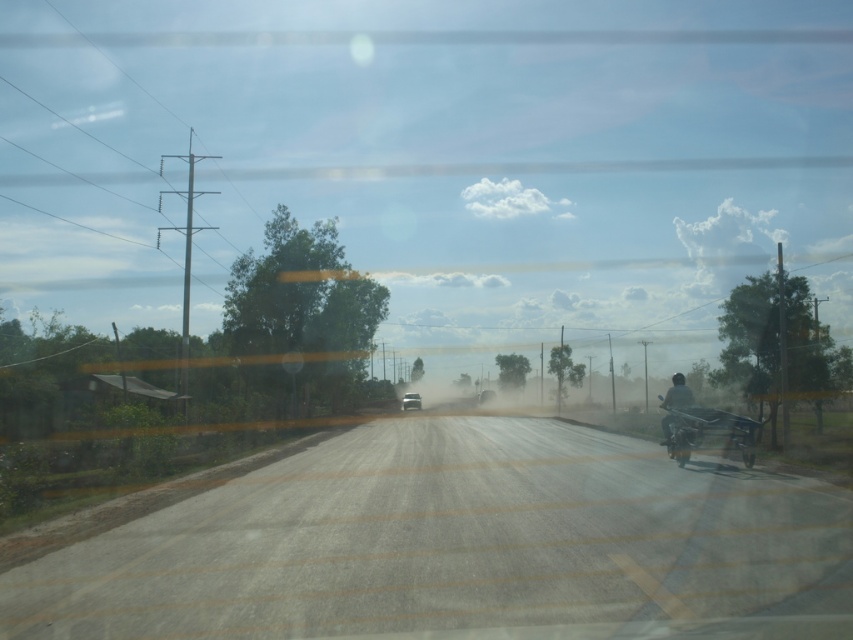
Question: Is dark matte motorbike at right to the right of dark gray motorcycle at right from the viewer's perspective?

Choices:
 (A) no
 (B) yes

Answer: (B)

Question: Is shiny black motorcycle at right smaller than metallic silver car at center?

Choices:
 (A) yes
 (B) no

Answer: (A)

Question: Estimate the real-world distances between objects in this image. Which object is closer to the shiny black motorcycle at right?

Choices:
 (A) metallic silver car at center
 (B) dark gray motorcycle at right
 (C) dark matte motorbike at right

Answer: (B)

Question: Can you confirm if shiny black motorcycle at right is smaller than dark gray motorcycle at right?

Choices:
 (A) yes
 (B) no

Answer: (A)

Question: Which point is farther to the camera?

Choices:
 (A) dark gray motorcycle at right
 (B) dark matte motorbike at right
 (C) shiny black motorcycle at right
 (D) metallic silver car at center

Answer: (D)

Question: Which of these objects is positioned closest to the shiny black motorcycle at right?

Choices:
 (A) dark matte motorbike at right
 (B) metallic silver car at center
 (C) dark gray motorcycle at right

Answer: (C)